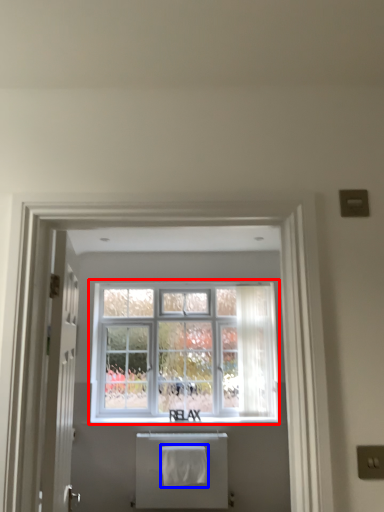
Question: Which of the following is the closest to the observer, window (highlighted by a red box) or bath towel (highlighted by a blue box)?

Choices:
 (A) window
 (B) bath towel

Answer: (B)